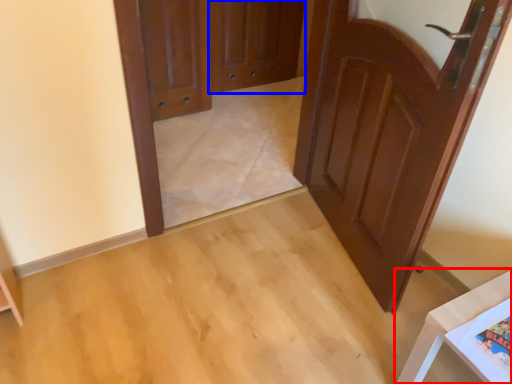
Question: Among these objects, which one is farthest to the camera, furniture (highlighted by a red box) or screen door (highlighted by a blue box)?

Choices:
 (A) furniture
 (B) screen door

Answer: (B)